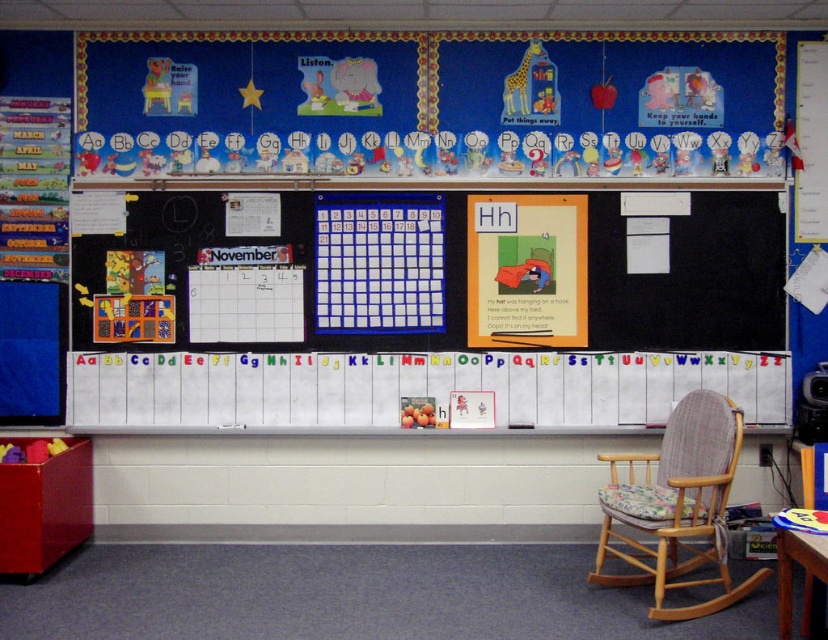
Which is below, matte black calendar at center or wooden upholstered rocking chair at lower right?

Positioned lower is wooden upholstered rocking chair at lower right.

Between matte black calendar at center and wooden upholstered rocking chair at lower right, which one has less height?

A: matte black calendar at center is shorter.

Which is in front, point (453, 273) or point (677, 516)?

Point (677, 516) is more forward.

This screenshot has width=828, height=640. Find the location of `matte black calendar at center`. matte black calendar at center is located at coordinates (691, 276).

Can you confirm if wooden upholstered rocking chair at lower right is positioned below wooden table at lower right?

Indeed, wooden upholstered rocking chair at lower right is positioned under wooden table at lower right.

Based on the photo, who is more forward, (679,532) or (812,544)?

Positioned in front is point (812,544).

This screenshot has width=828, height=640. Identify the location of wooden upholstered rocking chair at lower right. (677, 502).

Between matte black calendar at center and wooden table at lower right, which one appears on the right side from the viewer's perspective?

Positioned to the right is wooden table at lower right.

Is point (126, 248) farther from viewer compared to point (773, 516)?

No, (126, 248) is closer to viewer.

The width and height of the screenshot is (828, 640). Find the location of `matte black calendar at center`. matte black calendar at center is located at coordinates (691, 276).